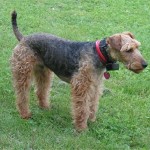
The height and width of the screenshot is (150, 150). I want to click on box, so click(114, 67).